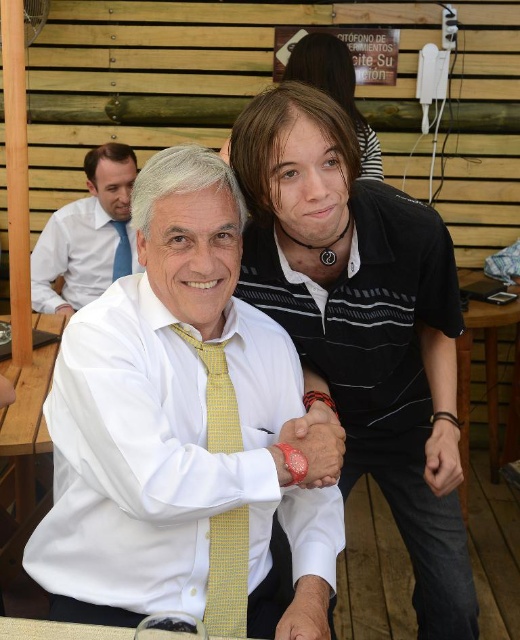
Question: Is black striped polo shirt at center to the right of striped polo shirt at upper center from the viewer's perspective?

Choices:
 (A) no
 (B) yes

Answer: (B)

Question: Is striped polo shirt at upper center positioned in front of yellowtexturetie at center?

Choices:
 (A) no
 (B) yes

Answer: (B)

Question: Which of the following is the farthest from the observer?

Choices:
 (A) (128, 250)
 (B) (314, 404)
 (C) (230, 557)
 (D) (152, 218)

Answer: (A)

Question: Estimate the real-world distances between objects in this image. Which object is farther from the white matte shirt at center?

Choices:
 (A) striped polo shirt at upper center
 (B) white shirt at upper left
 (C) yellowtexturetie at center

Answer: (C)

Question: Which point is farther to the camera?

Choices:
 (A) (122, 264)
 (B) (451, 614)
 (C) (369, 173)
 (D) (231, 401)

Answer: (A)

Question: Can you confirm if white matte shirt at center is bigger than black striped polo shirt at center?

Choices:
 (A) no
 (B) yes

Answer: (A)